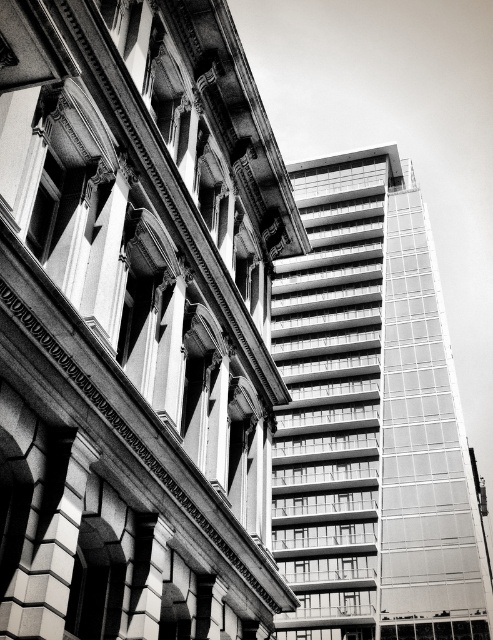
You are an urban planner analyzing the layout of this city block. You need to determine which building between the smooth glass skyscraper at center and the glassy reflective building at right occupies more horizontal space. Based on the scene, which one is wider?

The smooth glass skyscraper at center has a lesser width compared to the glassy reflective building at right, so the glassy reflective building at right is wider.

You are standing at the point indicated by point (137,323) in the image, which is at the center of the smooth glass skyscraper. Looking around, you notice the classical building on the left and the modern highrise on the right. Which direction should you face to see the classical building with ornate cornices and arched windows?

You should face to the left to see the classical building with ornate cornices and arched windows, as it is located to the left of the smooth glass skyscraper at center.

You are an urban planner analyzing the layout of this city block. You need to determine if there is enough space to construct a new small office building between the smooth glass skyscraper at center and the glassy reflective building at right. Based on their spatial occupation, can you confirm if there is sufficient space?

The smooth glass skyscraper at center occupies less space than the glassy reflective building at right. Therefore, there might be limited space between them for a new small office building, but further measurements are needed to confirm.